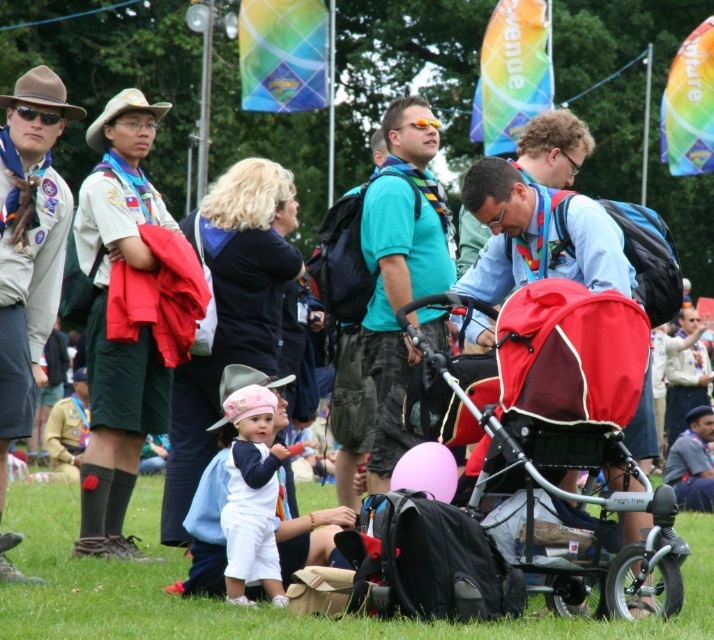
You are a photographer trying to capture a clear shot of both the red fabric baby carriage at center and the pink matte balloon at center. Since you want both objects in focus, which one should you focus on first to ensure depth of field?

The red fabric baby carriage at center is closer to the viewer than the pink matte balloon at center. To ensure both are in focus, you should focus on the red fabric baby carriage at center first.

You are a photographer trying to capture a photo of the khaki uniform at left and the pink matte balloon at center. Which object should you zoom in on to make them appear the same size in the photo?

The khaki uniform at left is larger in size than the pink matte balloon at center, so you should zoom in on the pink matte balloon at center to make them appear the same size in the photo.

You are a parent holding a 1.5 meter long ladder. You need to place it between the red fabric baby carriage at center and the pink matte balloon at center. Is there enough space to fit the ladder horizontally between them?

The distance between the red fabric baby carriage at center and the pink matte balloon at center is 2.93 meters. Since the ladder is 1.5 meters long, there is sufficient space to place it horizontally between them.